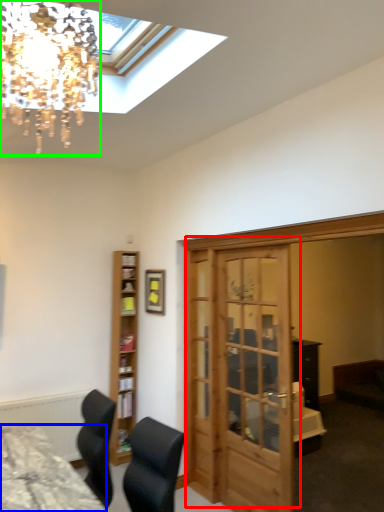
Question: Which is nearer to the door (highlighted by a red box)? desk (highlighted by a blue box) or lamp (highlighted by a green box).

Choices:
 (A) desk
 (B) lamp

Answer: (A)